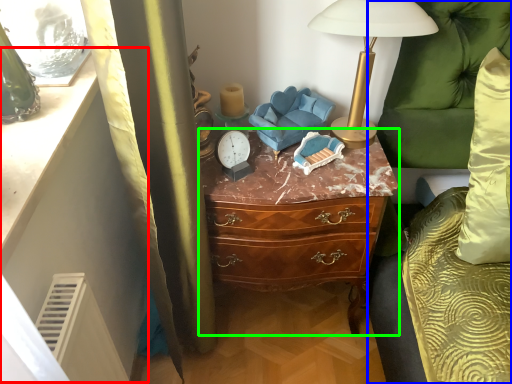
Question: Which object is positioned closest to vanity (highlighted by a red box)? Select from couch (highlighted by a blue box) and chest of drawers (highlighted by a green box).

Choices:
 (A) couch
 (B) chest of drawers

Answer: (B)